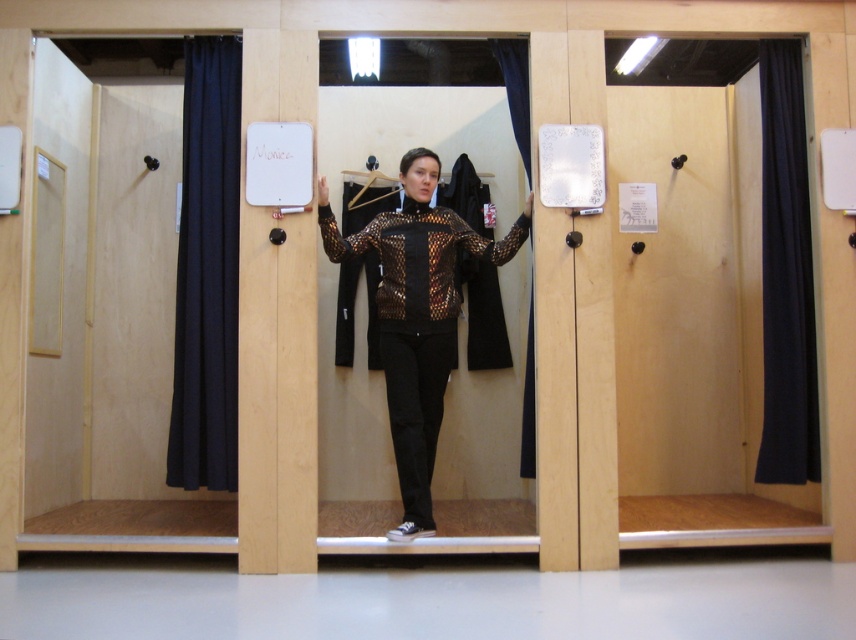
Find the location of a particular element. Image resolution: width=856 pixels, height=640 pixels. dark blue fabric curtain at right is located at coordinates (786, 275).

Does dark blue fabric curtain at right have a greater height compared to black fabric curtain at center?

Yes.

Does point (774, 257) lie behind point (527, 115)?

Yes, point (774, 257) is farther from viewer.

You are a GUI agent. You are given a task and a screenshot of the screen. Output one action in this format:
    pyautogui.click(x=<x>, y=<y>)
    Task: Click on the dark blue fabric curtain at right
    
    Given the screenshot: What is the action you would take?
    pyautogui.click(x=786, y=275)

Looking at this image, is dark blue fabric curtain at right taller than metallic silver hanger at center?

Yes, dark blue fabric curtain at right is taller than metallic silver hanger at center.

How far apart are dark blue fabric curtain at right and metallic silver hanger at center?

They are 1.99 meters apart.

The height and width of the screenshot is (640, 856). Describe the element at coordinates (786, 275) in the screenshot. I see `dark blue fabric curtain at right` at that location.

Image resolution: width=856 pixels, height=640 pixels. Identify the location of dark blue fabric curtain at right. (786, 275).

Does point (206, 115) come in front of point (788, 273)?

That is True.

Who is more forward, (211, 170) or (813, 445)?

Positioned in front is point (211, 170).

At what (x,y) coordinates should I click in order to perform the action: click on black fabric curtain at left. Please return your answer as a coordinate pair (x, y). This screenshot has width=856, height=640. Looking at the image, I should click on (207, 272).